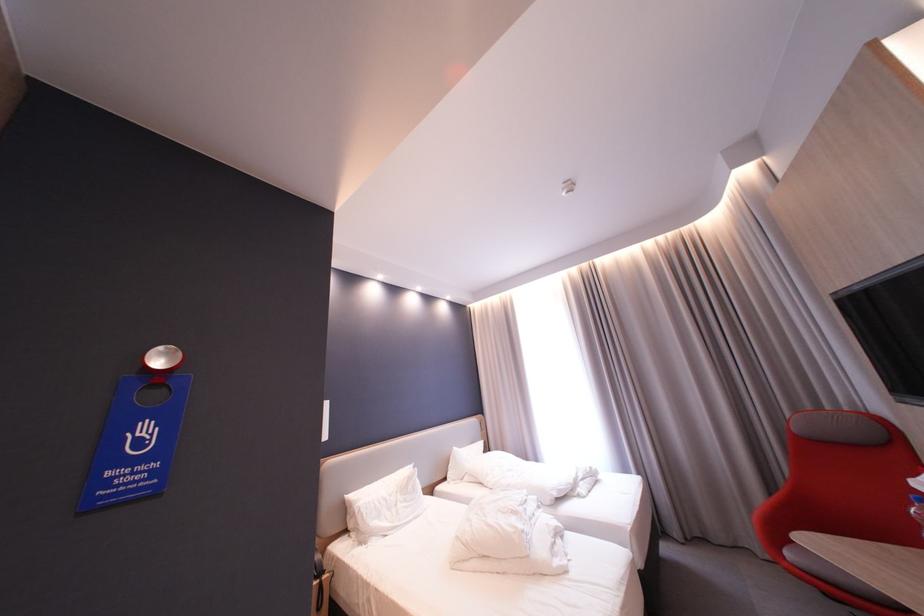
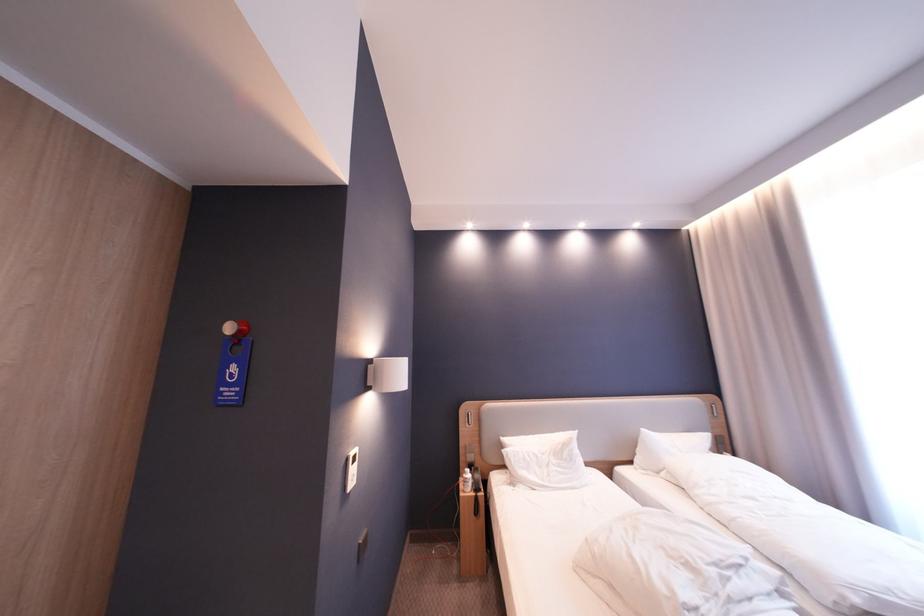
Find the pixel in the second image that matches (456,480) in the first image.

(641, 464)